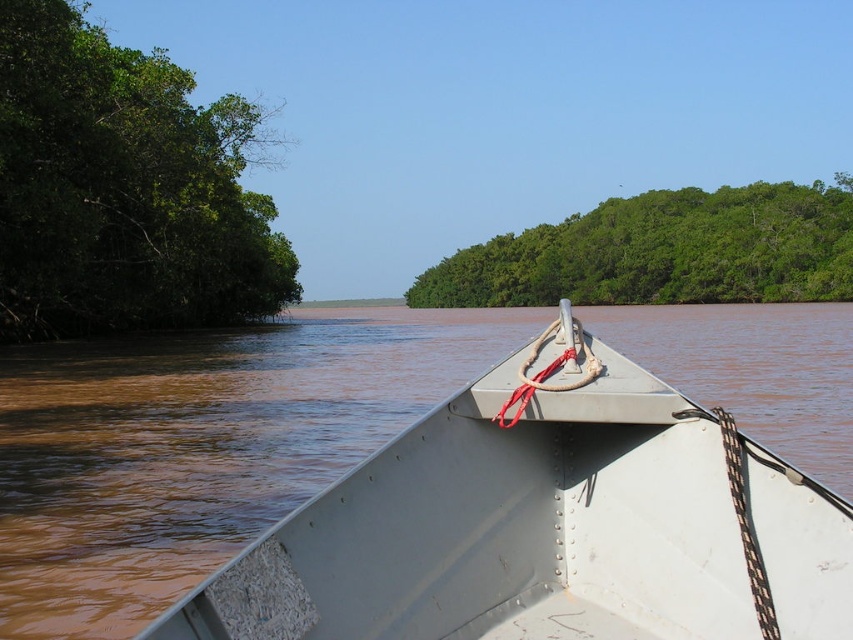
Question: Can you confirm if metallic gray boat at center is bigger than green leafy trees at upper center?

Choices:
 (A) no
 (B) yes

Answer: (A)

Question: Which of the following is the farthest from the observer?

Choices:
 (A) (672, 196)
 (B) (413, 557)
 (C) (250, 134)

Answer: (A)

Question: Can you confirm if metallic gray boat at center is positioned below green leafy trees at upper center?

Choices:
 (A) no
 (B) yes

Answer: (B)

Question: Which of the following is the closest to the observer?

Choices:
 (A) (351, 627)
 (B) (67, 150)
 (C) (723, 214)

Answer: (A)

Question: Which object is closer to the camera taking this photo?

Choices:
 (A) metallic gray boat at center
 (B) green leafy trees at upper center

Answer: (A)

Question: Does metallic gray boat at center appear over green leafy trees at upper center?

Choices:
 (A) yes
 (B) no

Answer: (B)